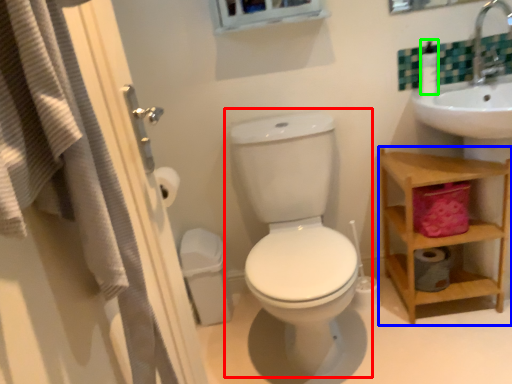
Question: Which object is the farthest from toilet (highlighted by a red box)? Choose among these: shelf (highlighted by a blue box) or soap dispenser (highlighted by a green box).

Choices:
 (A) shelf
 (B) soap dispenser

Answer: (B)